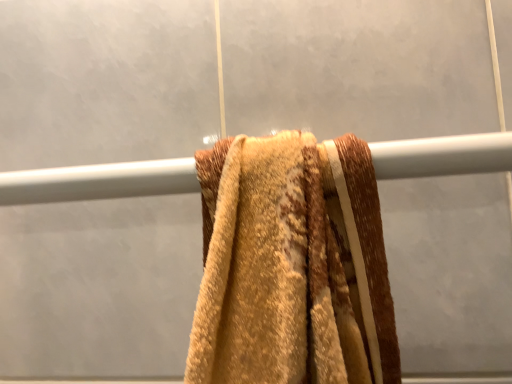
Question: Should I look upward or downward to see metallic silver towel bar at center?

Choices:
 (A) down
 (B) up

Answer: (B)